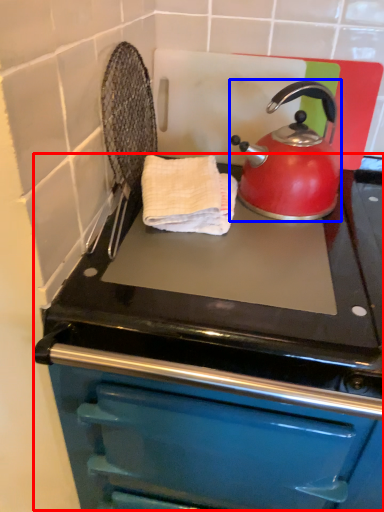
Question: Which object appears farthest to the camera in this image, oven (highlighted by a red box) or kettle (highlighted by a blue box)?

Choices:
 (A) oven
 (B) kettle

Answer: (B)